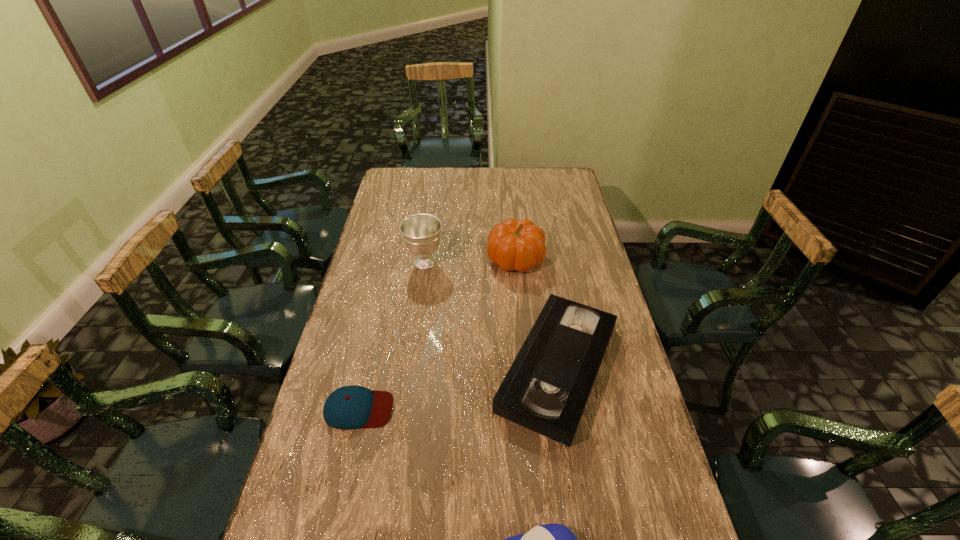
You are a GUI agent. You are given a task and a screenshot of the screen. Output one action in this format:
    pyautogui.click(x=<x>, y=<y>)
    Task: Click on the object positioned at the right edge
    The width and height of the screenshot is (960, 540).
    Given the screenshot: What is the action you would take?
    pyautogui.click(x=546, y=389)

In the image, there is a desktop. At what (x,y) coordinates should I click in order to perform the action: click on vacant space at the left edge. Please return your answer as a coordinate pair (x, y). This screenshot has height=540, width=960. Looking at the image, I should click on (393, 269).

Identify the location of vacant space at the right edge of the desktop. This screenshot has height=540, width=960. (573, 207).

The height and width of the screenshot is (540, 960). In the image, there is a desktop. Identify the location of free space at the far left corner. (422, 169).

Locate an element on the screen. The height and width of the screenshot is (540, 960). vacant space at the far right corner is located at coordinates (566, 183).

You are a GUI agent. You are given a task and a screenshot of the screen. Output one action in this format:
    pyautogui.click(x=<x>, y=<y>)
    Task: Click on the vacant space in between the left baseball cap and the pumpkin
    This screenshot has width=960, height=540.
    Given the screenshot: What is the action you would take?
    pyautogui.click(x=437, y=334)

At what (x,y) coordinates should I click in order to perform the action: click on vacant space in between the shorter baseball cap and the chalice. Please return your answer as a coordinate pair (x, y). This screenshot has height=540, width=960. Looking at the image, I should click on (392, 336).

Locate an element on the screen. This screenshot has height=540, width=960. free point between the left baseball cap and the pumpkin is located at coordinates [x=437, y=334].

In order to click on free space between the chalice and the videotape in this screenshot , I will do `click(492, 315)`.

Locate an element on the screen. vacant space in between the shorter baseball cap and the pumpkin is located at coordinates (437, 334).